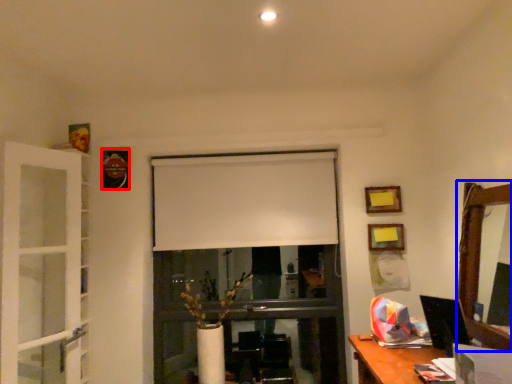
Question: Which point is closer to the camera, picture frame (highlighted by a red box) or mirror (highlighted by a blue box)?

Choices:
 (A) picture frame
 (B) mirror

Answer: (B)